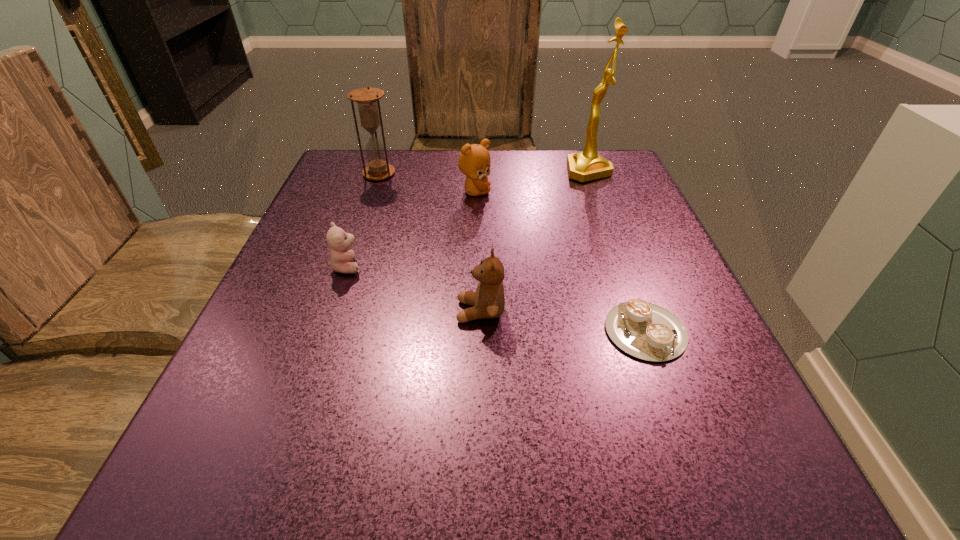
Identify the location of the tallest object. The image size is (960, 540). [x=588, y=165].

This screenshot has width=960, height=540. I want to click on the fifth shortest object, so click(x=367, y=99).

Locate an element on the screen. This screenshot has height=540, width=960. the farthest teddy bear is located at coordinates (474, 162).

Find the location of `the nearest teddy bear`. the nearest teddy bear is located at coordinates (488, 301).

Identify the location of the second shortest object. The width and height of the screenshot is (960, 540). pyautogui.click(x=341, y=257).

I want to click on the leftmost teddy bear, so click(341, 257).

This screenshot has width=960, height=540. In order to click on the shortest object in this screenshot , I will do `click(647, 331)`.

Identify the location of free space located 0.140m on the front-facing side of the award. The width and height of the screenshot is (960, 540). (507, 171).

Identify the location of vacant space positioned 0.060m on the front-facing side of the award. (540, 171).

The image size is (960, 540). In order to click on free space located on the front-facing side of the award in this screenshot , I will do `click(446, 171)`.